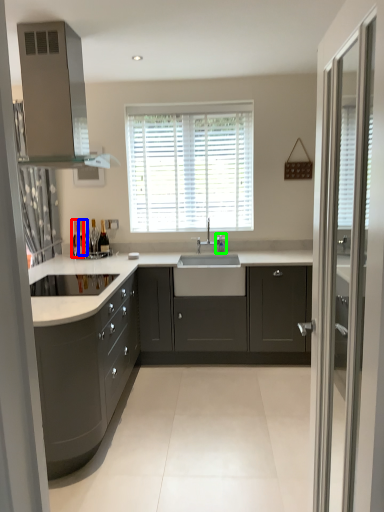
Question: Which is nearer to the bottle (highlighted by a red box)? bottle (highlighted by a blue box) or faucet (highlighted by a green box).

Choices:
 (A) bottle
 (B) faucet

Answer: (A)